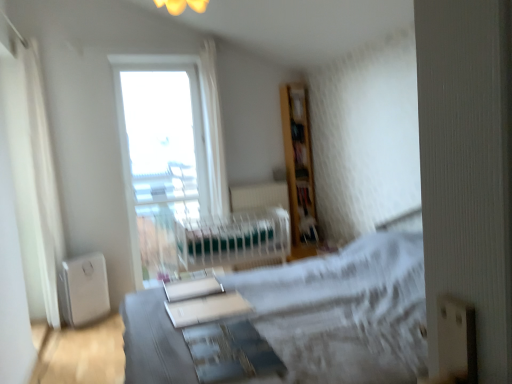
Locate an element on the screen. The width and height of the screenshot is (512, 384). green fabric hospital bed at center is located at coordinates (233, 239).

Locate an element on the screen. This screenshot has width=512, height=384. transparent glass window at upper center is located at coordinates (204, 124).

What is the approximate width of white plastic air purifier at lower left?

9.46 inches.

Identify the location of wooden bookshelf at upper right. Image resolution: width=512 pixels, height=384 pixels. (297, 103).

Describe the element at coordinates (297, 103) in the screenshot. I see `wooden bookshelf at upper right` at that location.

Image resolution: width=512 pixels, height=384 pixels. Find the location of `green fabric hospital bed at center`. green fabric hospital bed at center is located at coordinates (233, 239).

Identify the location of shelf located above the white plastic air purifier at lower left (from a real-world perspective). This screenshot has width=512, height=384. (297, 103).

Is the depth of wooden bookshelf at upper right less than that of white plastic air purifier at lower left?

No, wooden bookshelf at upper right is further to the viewer.

From the image's perspective, relative to white plastic air purifier at lower left, is wooden bookshelf at upper right above or below?

Based on their image positions, wooden bookshelf at upper right is located above white plastic air purifier at lower left.

How different are the orientations of wooden bookshelf at upper right and white plastic air purifier at lower left in degrees?

The angular difference between wooden bookshelf at upper right and white plastic air purifier at lower left is 38.2 degrees.

Is transparent glass window at upper center aimed at green fabric hospital bed at center?

Yes, transparent glass window at upper center faces towards green fabric hospital bed at center.

Can you confirm if transparent glass window at upper center is bigger than green fabric hospital bed at center?

Correct, transparent glass window at upper center is larger in size than green fabric hospital bed at center.

From a real-world perspective, is transparent glass window at upper center above or below green fabric hospital bed at center?

In terms of real-world spatial position, transparent glass window at upper center is above green fabric hospital bed at center.

From the image's perspective, is transparent glass window at upper center on green fabric hospital bed at center?

Yes, from the image's perspective, transparent glass window at upper center is over green fabric hospital bed at center.

Would you say green fabric hospital bed at center contains white plastic air purifier at lower left?

No, white plastic air purifier at lower left is located outside of green fabric hospital bed at center.

Is point (202, 239) less distant than point (85, 279)?

Yes, point (202, 239) is in front of point (85, 279).

Which object is more forward, green fabric hospital bed at center or white plastic air purifier at lower left?

white plastic air purifier at lower left is in front.

Is green fabric hospital bed at center far away from white plastic air purifier at lower left?

green fabric hospital bed at center is far away from white plastic air purifier at lower left.

Which of these two, transparent glass window at upper center or white sheer curtain at left, is smaller?

With smaller size is white sheer curtain at left.

From a real-world perspective, is transparent glass window at upper center on top of white sheer curtain at left?

No.

Considering the sizes of objects transparent glass window at upper center and white sheer curtain at left in the image provided, who is shorter, transparent glass window at upper center or white sheer curtain at left?

With less height is transparent glass window at upper center.

Is point (125, 63) closer or farther from the camera than point (36, 163)?

Point (125, 63) appears to be farther away from the viewer than point (36, 163).

Can you tell me how much green fabric hospital bed at center and transparent glass window at upper center differ in facing direction?

0.613 degrees separate the facing orientations of green fabric hospital bed at center and transparent glass window at upper center.

Could you tell me if green fabric hospital bed at center is turned towards transparent glass window at upper center?

No, green fabric hospital bed at center does not turn towards transparent glass window at upper center.

Considering the relative positions of green fabric hospital bed at center and transparent glass window at upper center in the image provided, is green fabric hospital bed at center to the right of transparent glass window at upper center from the viewer's perspective?

Yes, green fabric hospital bed at center is to the right of transparent glass window at upper center.

From a real-world perspective, who is located higher, green fabric hospital bed at center or transparent glass window at upper center?

From a 3D spatial view, transparent glass window at upper center is above.

Between point (292, 113) and point (205, 91), which one is positioned behind?

The point (292, 113) is farther.

Considering the relative sizes of wooden bookshelf at upper right and transparent glass window at upper center in the image provided, is wooden bookshelf at upper right wider than transparent glass window at upper center?

Yes.

Is wooden bookshelf at upper right facing away from transparent glass window at upper center?

No, transparent glass window at upper center is not at the back of wooden bookshelf at upper right.

Is wooden bookshelf at upper right next to transparent glass window at upper center and touching it?

No, wooden bookshelf at upper right is not beside transparent glass window at upper center.

Which is more to the left, white sheer curtain at left or white plastic air purifier at lower left?

white sheer curtain at left is more to the left.

Is white sheer curtain at left in front of or behind white plastic air purifier at lower left in the image?

In the image, white sheer curtain at left appears in front of white plastic air purifier at lower left.

The height and width of the screenshot is (384, 512). I want to click on appliance below the white sheer curtain at left (from a real-world perspective), so click(x=83, y=289).

Does white sheer curtain at left have a lesser height compared to white plastic air purifier at lower left?

In fact, white sheer curtain at left may be taller than white plastic air purifier at lower left.

Identify the location of appliance located below the wooden bookshelf at upper right (from the image's perspective). (83, 289).

This screenshot has height=384, width=512. I want to click on hospital bed below the transparent glass window at upper center (from a real-world perspective), so click(233, 239).

From the picture: When comparing their distances from white sheer curtain at left, does green fabric hospital bed at center or transparent glass window at upper center seem closer?

Based on the image, transparent glass window at upper center appears to be nearer to white sheer curtain at left.

Estimate the real-world distances between objects in this image. Which object is closer to white sheer curtain at left, green fabric hospital bed at center or white plastic air purifier at lower left?

Among the two, white plastic air purifier at lower left is located nearer to white sheer curtain at left.

Which object lies nearer to the anchor point white sheer curtain at left, transparent glass window at upper center or green fabric hospital bed at center?

transparent glass window at upper center is positioned closer to the anchor white sheer curtain at left.

Estimate the real-world distances between objects in this image. Which object is further from green fabric hospital bed at center, transparent glass window at upper center or wooden bookshelf at upper right?

wooden bookshelf at upper right lies further to green fabric hospital bed at center than the other object.

Looking at this image, from the image, which object appears to be farther from transparent glass window at upper center, green fabric hospital bed at center or wooden bookshelf at upper right?

A: wooden bookshelf at upper right lies further to transparent glass window at upper center than the other object.

Looking at the image, which one is located closer to transparent glass window at upper center, white sheer curtain at left or white plastic air purifier at lower left?

white sheer curtain at left.

From the image, which object appears to be nearer to white plastic air purifier at lower left, green fabric hospital bed at center or wooden bookshelf at upper right?

green fabric hospital bed at center lies closer to white plastic air purifier at lower left than the other object.

Which object lies further to the anchor point transparent glass window at upper center, white plastic air purifier at lower left or wooden bookshelf at upper right?

white plastic air purifier at lower left is further to transparent glass window at upper center.

Image resolution: width=512 pixels, height=384 pixels. In order to click on window between white plastic air purifier at lower left and green fabric hospital bed at center in this screenshot , I will do `click(204, 124)`.

Image resolution: width=512 pixels, height=384 pixels. I want to click on window situated between white plastic air purifier at lower left and wooden bookshelf at upper right from left to right, so click(204, 124).

This screenshot has height=384, width=512. I want to click on appliance located between white sheer curtain at left and green fabric hospital bed at center in the left-right direction, so click(x=83, y=289).

Find the location of `curtain that lies between transparent glass window at upper center and white plastic air purifier at lower left from top to bottom`. curtain that lies between transparent glass window at upper center and white plastic air purifier at lower left from top to bottom is located at coordinates (42, 182).